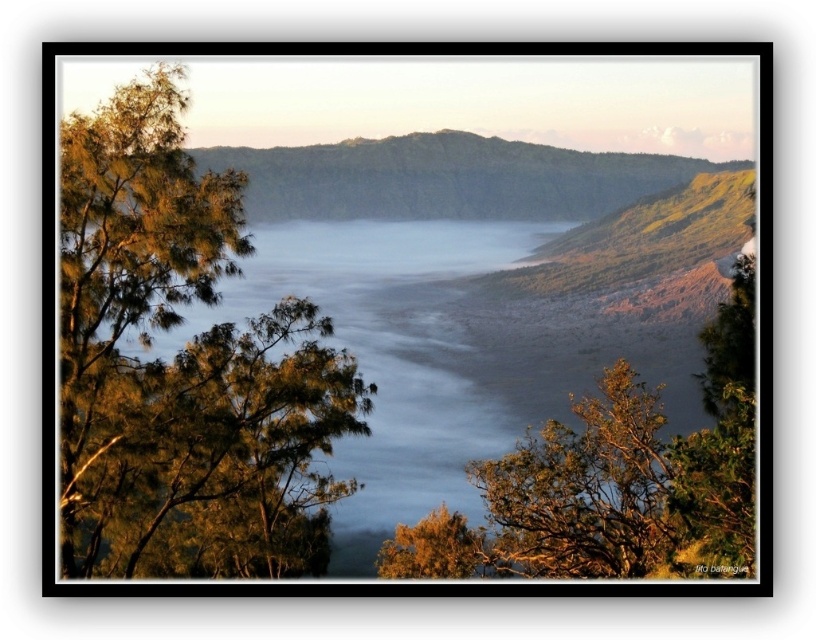
You are planning to set up a small tent for a photography session. The green grassy hill at center and the green leafy tree at lower center are both in your view. Considering their sizes, which area would provide a wider space to set up your equipment?

The green grassy hill at center has a larger width than the green leafy tree at lower center, so it would provide a wider space to set up your equipment.

You are a hiker standing at the edge of the volcanic crater. You see the green leafy tree at left and the green leafy tree at lower center. Which tree would appear closer to you based on their sizes?

The green leafy tree at left appears closer because it is larger in size than the green leafy tree at lower center, suggesting it is nearer to the observer.